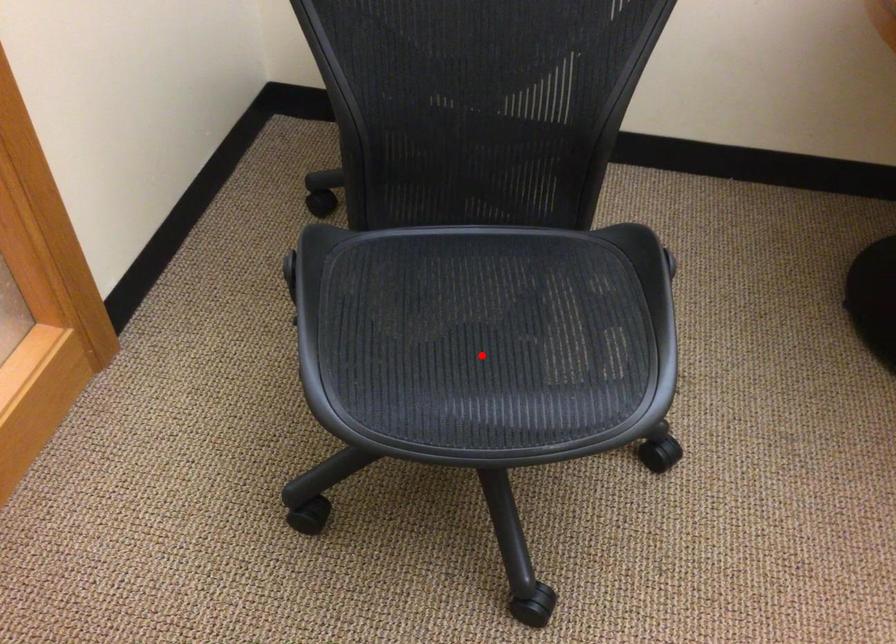
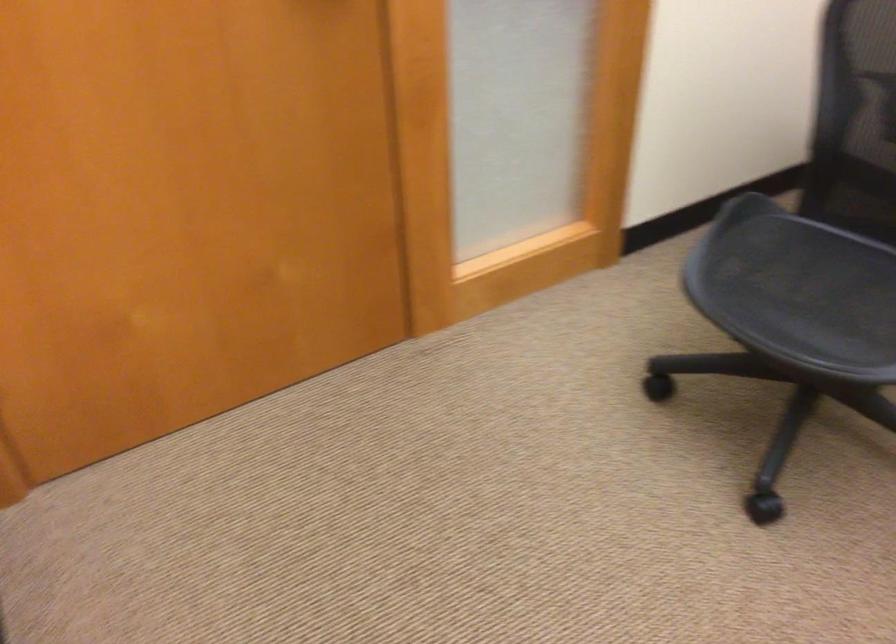
Where in the second image is the point corresponding to the highlighted location from the first image?

(805, 295)